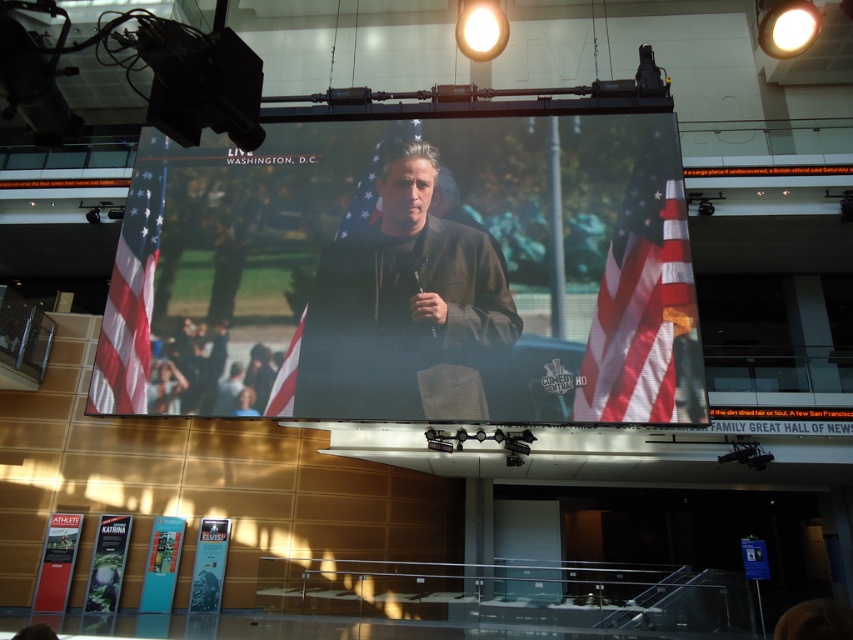
Does matte american flag at right appear over red-white-striped flag at left?

Indeed, matte american flag at right is positioned over red-white-striped flag at left.

Between matte american flag at right and red-white-striped flag at left, which one is positioned higher?

matte american flag at right is above.

The height and width of the screenshot is (640, 853). Identify the location of matte american flag at right. (646, 301).

Can you confirm if matte american flag at right is taller than american flag at center?

Yes.

Who is shorter, matte american flag at right or american flag at center?

Standing shorter between the two is american flag at center.

Which is behind, point (627, 266) or point (374, 188)?

Positioned behind is point (374, 188).

You are a GUI agent. You are given a task and a screenshot of the screen. Output one action in this format:
    pyautogui.click(x=<x>, y=<y>)
    Task: Click on the matte american flag at right
    This screenshot has height=640, width=853.
    Given the screenshot: What is the action you would take?
    pyautogui.click(x=646, y=301)

Is brown leather jacket at center shorter than red-white-striped flag at left?

No.

Can you confirm if brown leather jacket at center is positioned below red-white-striped flag at left?

Incorrect, brown leather jacket at center is not positioned below red-white-striped flag at left.

In order to click on brown leather jacket at center in this screenshot , I will do `click(404, 307)`.